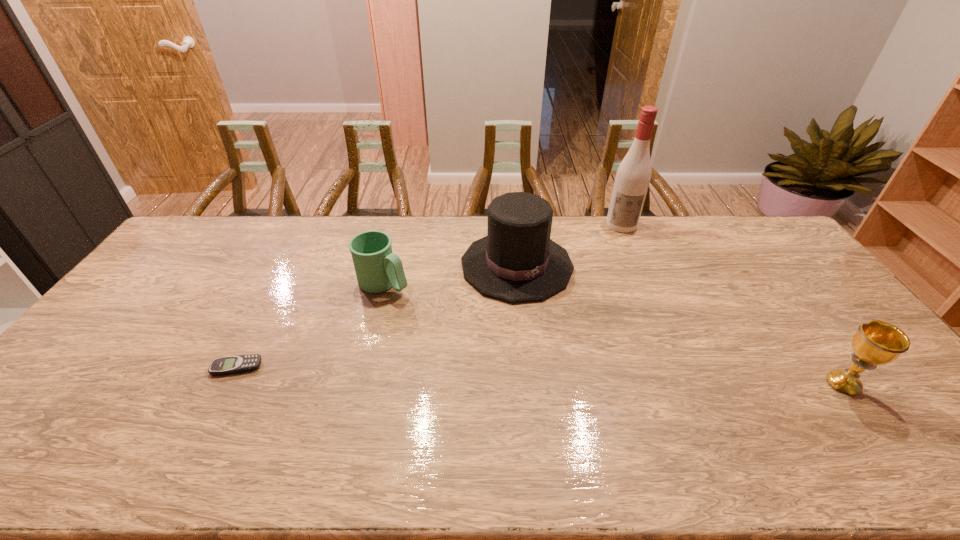
You are a GUI agent. You are given a task and a screenshot of the screen. Output one action in this format:
    pyautogui.click(x=<x>, y=<y>)
    Task: Click on the vacant region located 0.330m on the label of the second object from right to left
    This screenshot has height=540, width=960.
    Given the screenshot: What is the action you would take?
    pyautogui.click(x=622, y=293)

The height and width of the screenshot is (540, 960). Identify the location of dress hat that is at the far edge. (517, 261).

I want to click on alcohol positioned at the far edge, so click(633, 176).

Where is `object that is at the near edge`? The width and height of the screenshot is (960, 540). object that is at the near edge is located at coordinates (876, 342).

Where is `object that is at the right edge`? This screenshot has width=960, height=540. object that is at the right edge is located at coordinates point(876,342).

This screenshot has width=960, height=540. In order to click on object at the near right corner in this screenshot , I will do `click(876, 342)`.

Image resolution: width=960 pixels, height=540 pixels. In the image, there is a desktop. Identify the location of vacant space at the far edge. [x=304, y=230].

Find the location of a particular element. The width and height of the screenshot is (960, 540). free space at the near edge is located at coordinates (401, 426).

Where is `vacant space at the right edge of the desktop`? vacant space at the right edge of the desktop is located at coordinates (900, 395).

Where is `vacant space at the far left corner of the desktop`? The image size is (960, 540). vacant space at the far left corner of the desktop is located at coordinates (227, 218).